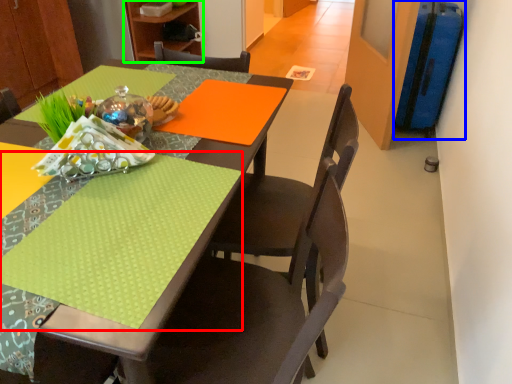
Question: Estimate the real-world distances between objects in this image. Which object is closer to tablecloth (highlighted by a red box), luggage (highlighted by a blue box) or bookshelf (highlighted by a green box)?

Choices:
 (A) luggage
 (B) bookshelf

Answer: (A)